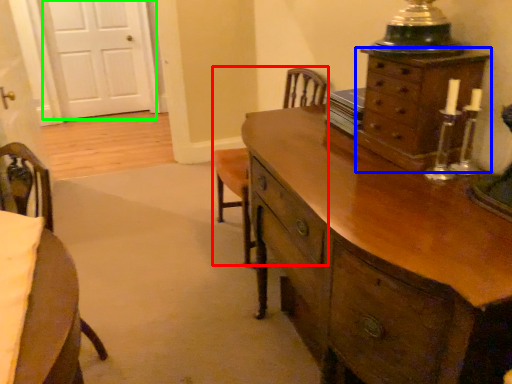
Question: Based on their relative distances, which object is farther from armchair (highlighted by a red box)? Choose from chest of drawers (highlighted by a blue box) and door (highlighted by a green box).

Choices:
 (A) chest of drawers
 (B) door

Answer: (B)